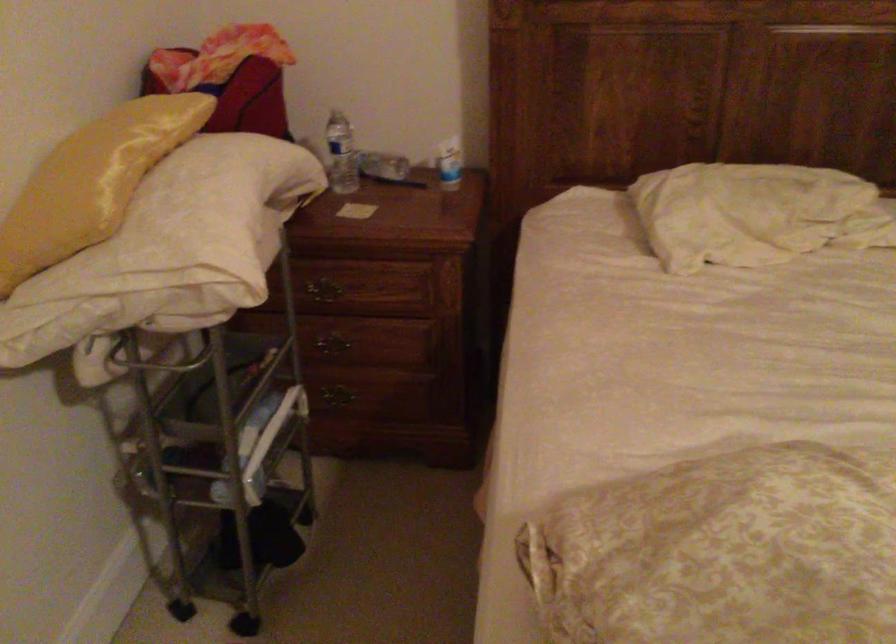
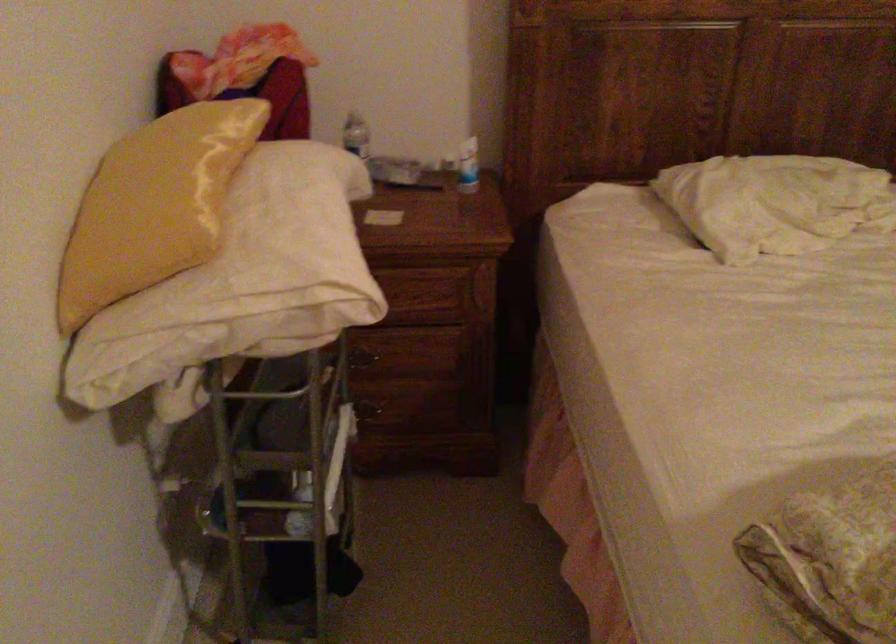
Where in the second image is the point corresponding to (446,164) from the first image?

(468, 166)